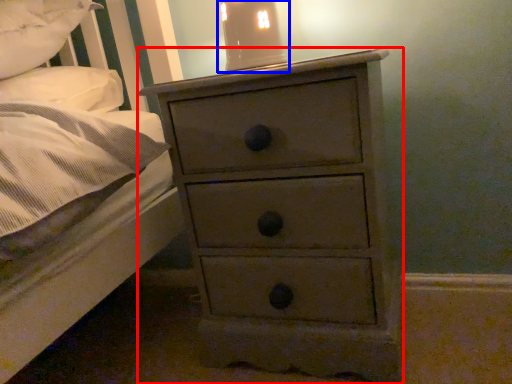
Question: Among these objects, which one is farthest to the camera, chest of drawers (highlighted by a red box) or bedside lamp (highlighted by a blue box)?

Choices:
 (A) chest of drawers
 (B) bedside lamp

Answer: (B)